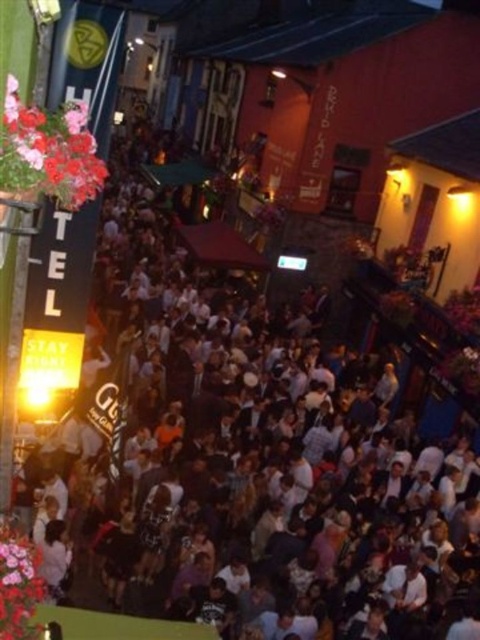
You are standing at the center of the street in the image. There is a point marked at coordinates point (48, 150). What is located at that point?

At point (48, 150) lies matte pink flowers at upper left.

You are a photographer standing in the middle of the street. You want to take a photo that includes both the matte pink flowers at upper left and the pink floral bouquet at lower left. Which one should you move your camera towards to capture both in the frame?

To capture both the matte pink flowers at upper left and the pink floral bouquet at lower left in the frame, you should move your camera towards the pink floral bouquet at lower left because the matte pink flowers at upper left is to the right of it, so adjusting the camera towards the lower left position will ensure both are included.

You are a photographer trying to capture the entire scene in one shot. You notice the matte pink flowers at upper left and the pink floral bouquet at lower left. Which one do you need to adjust your camera angle to include fully in the frame?

The pink floral bouquet at lower left is wider than the matte pink flowers at upper left, so you need to adjust your camera angle to include the pink floral bouquet at lower left fully in the frame.